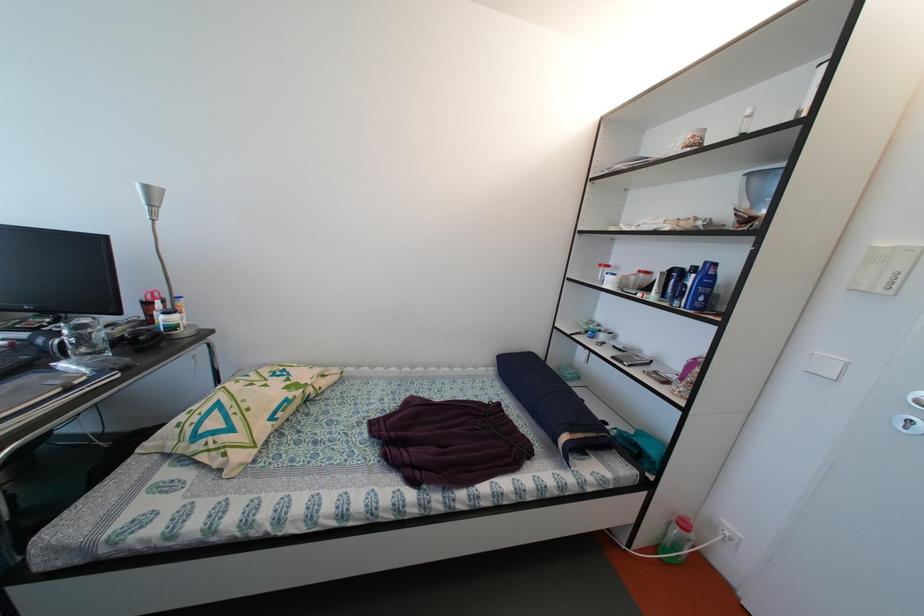
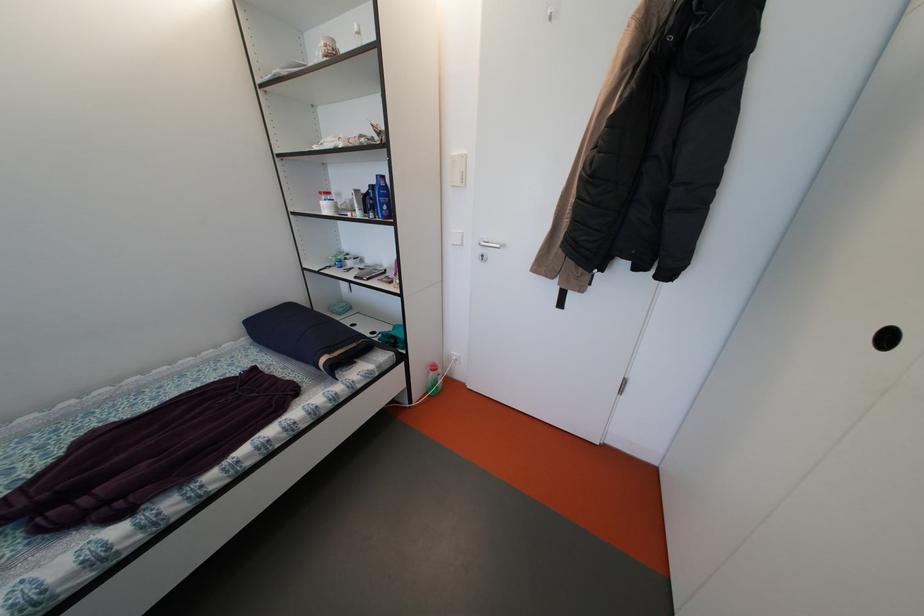
In the second image, find the point that corresponds to (608,270) in the first image.

(327, 198)